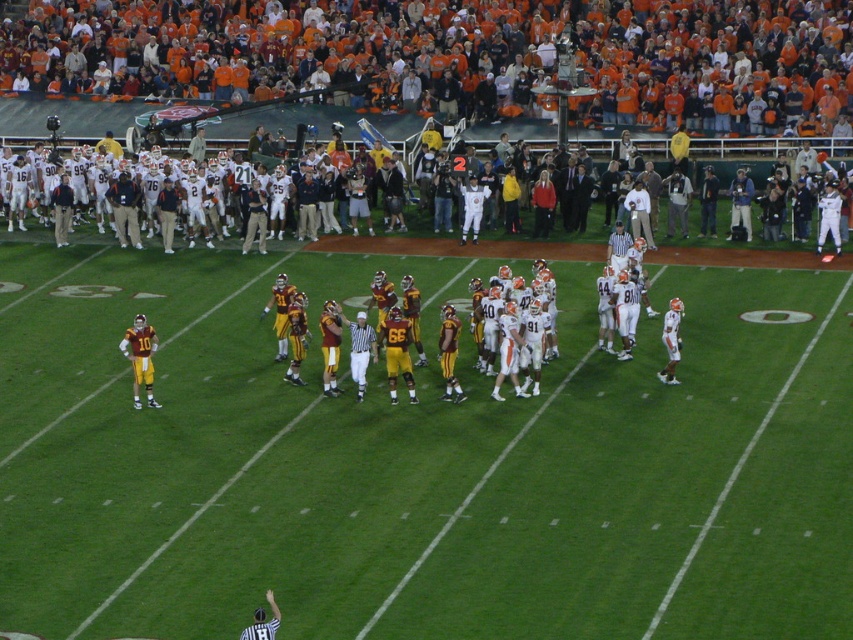
Question: Does orange jersey fans at upper center appear over yellow uniformed players at center?

Choices:
 (A) no
 (B) yes

Answer: (B)

Question: Can you confirm if orange jersey fans at upper center is positioned above yellow uniformed players at center?

Choices:
 (A) yes
 (B) no

Answer: (A)

Question: Observing the image, what is the correct spatial positioning of orange jersey fans at upper center in reference to yellow uniformed players at center?

Choices:
 (A) left
 (B) right

Answer: (B)

Question: Which point is closer to the camera?

Choices:
 (A) orange jersey fans at upper center
 (B) yellow uniformed players at center

Answer: (B)